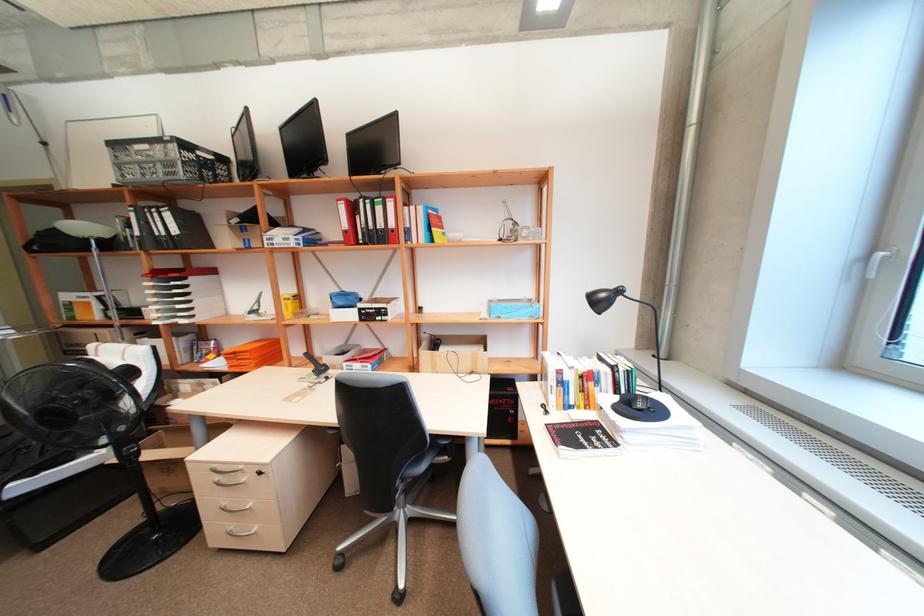
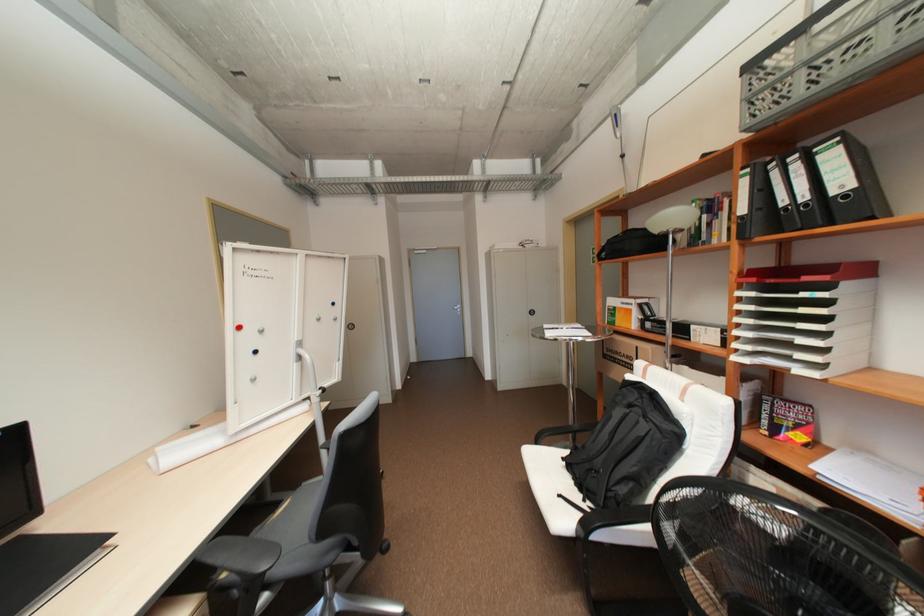
The point at (208, 365) is marked in the first image. Where is the corresponding point in the second image?

(820, 467)